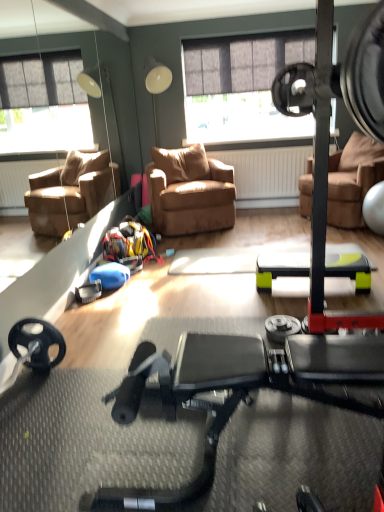
Question: Looking at the image, does brown leather chair at center, the second chair from the left, seem bigger or smaller compared to brown leather chair at center, the 1th chair positioned from the left?

Choices:
 (A) big
 (B) small

Answer: (A)

Question: Considering their positions, is brown leather chair at center, the second chair from the left, located in front of or behind brown leather chair at center, which is counted as the 2th chair, starting from the right?

Choices:
 (A) behind
 (B) front

Answer: (B)

Question: Based on their relative distances, which object is farther from the black rubber stationary bicycle at center?

Choices:
 (A) brown leather chair at center, the 1th chair positioned from the left
 (B) brown leather chair at center, the second chair from the left

Answer: (B)

Question: Considering the real-world distances, which object is farthest from the brown leather chair at center, the 1th chair positioned from the left?

Choices:
 (A) brown leather chair at center, the second chair from the left
 (B) black rubber stationary bicycle at center

Answer: (B)